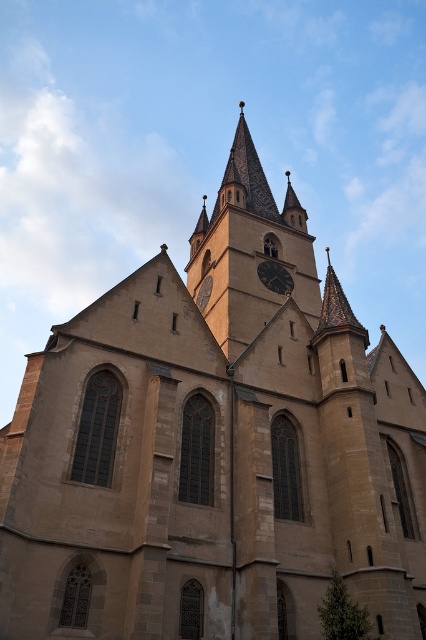
You are an architect examining the Gothic church and notice two clocks on the central tower. According to the image, which clock, the dark brown wooden clock at center or the dark brown stone clock at center, is located to the right?

The dark brown wooden clock at center is positioned on the right side of the dark brown stone clock at center, so the dark brown wooden clock at center is located to the right.

You are standing in front of the Gothic church and want to determine which of the two points, point (x=284, y=275) or point (x=201, y=310), is closer to you. Based on the image, which point is nearer?

Point (x=284, y=275) is closer to you because it is further to the viewer than point (x=201, y=310).

You are standing in front of the grand Gothic church and notice two central structures. Which one is taller between the brown stone clock tower at center and the dark brown wooden clock at center?

The brown stone clock tower at center is taller than the dark brown wooden clock at center.